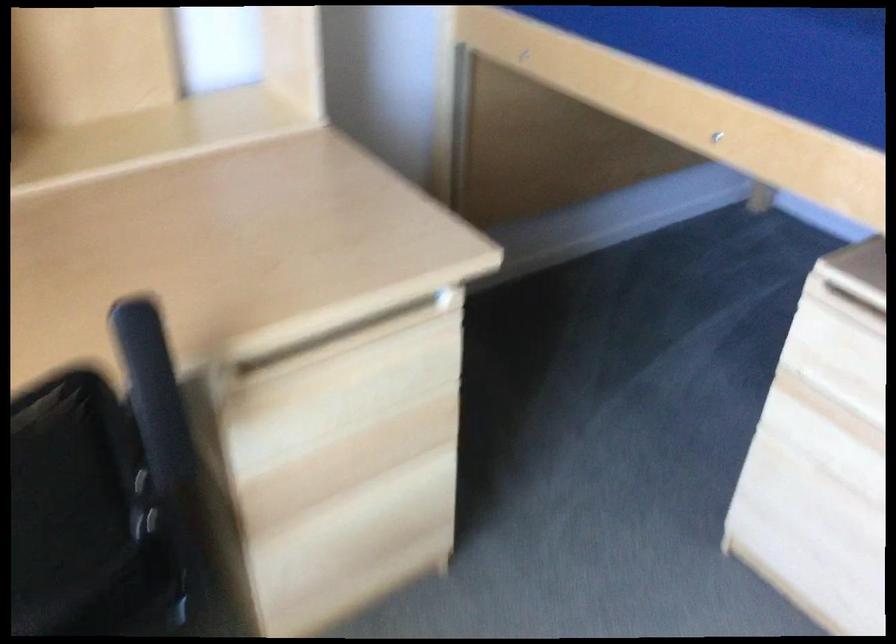
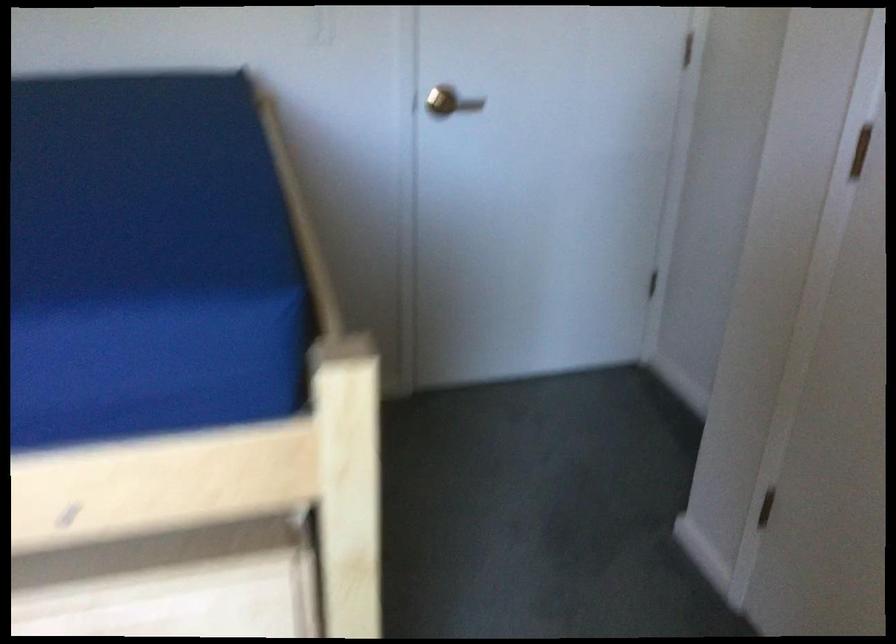
Question: Based on the continuous images, in which direction is the camera rotating? Reply with the corresponding letter.

Choices:
 (A) Left
 (B) Right
 (C) Up
 (D) Down

Answer: (B)